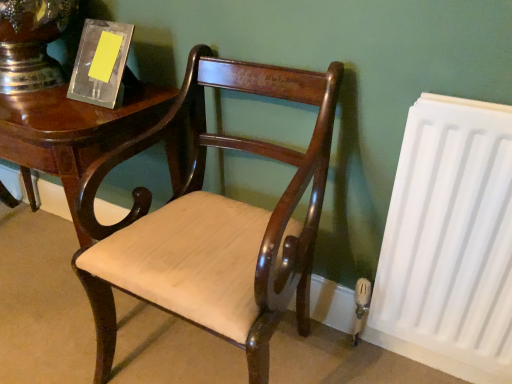
This screenshot has width=512, height=384. I want to click on vacant area situated to the left side of white matte radiator at right, so click(x=326, y=357).